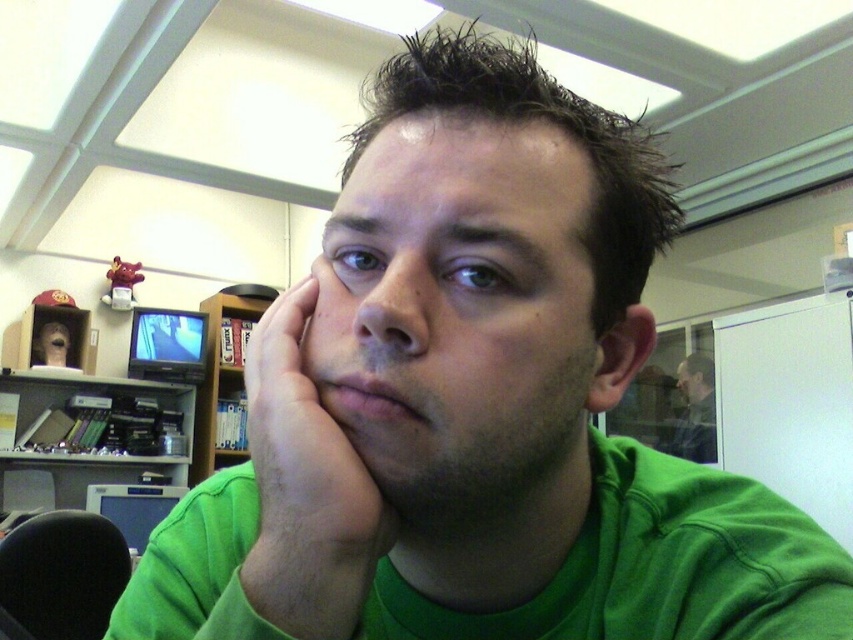
You are a photographer setting up a portrait in this scene. You need to ensure that the green matte hand at center is visible above the matte black jacket at upper right in the final shot. Based on their sizes, is this possible?

The green matte hand at center is not as tall as the matte black jacket at upper right, so it is possible to position the camera so that the green matte hand at center appears above the matte black jacket at upper right by adjusting the angle or framing to emphasize the hand over the jacket.

Based on the photo, you are an assistant organizing items in the office. You need to place the green matte hand at center and the matte black jacket at upper right on a shelf. The shelf has a width of 1 meter. Can both items fit side by side without overlapping?

The green matte hand at center has a smaller size compared to matte black jacket at upper right. However, since the exact dimensions of both items are not provided, it is impossible to determine if they can fit side by side on a 1 meter shelf without overlapping.

You are an interior designer assessing the layout of this room. You need to determine if the wooden bookshelf at upper center and the matte black jacket at upper right can be moved closer together without obstructing the small television that is displaying media content. Can they be moved closer?

The wooden bookshelf at upper center is positioned over the matte black jacket at upper right, meaning they are already aligned vertically. Moving them closer might not obstruct the small television, but since their vertical alignment is maintained, there might be space to adjust their horizontal distance without blocking the TV.